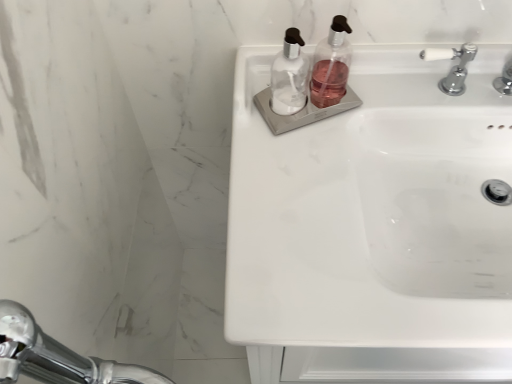
Question: Is white glossy sink at upper right at the right side of transparent plastic soap dispenser at center, the second soap dispenser positioned from the right?

Choices:
 (A) yes
 (B) no

Answer: (A)

Question: From a real-world perspective, does white glossy sink at upper right sit lower than transparent plastic soap dispenser at center, the second soap dispenser positioned from the right?

Choices:
 (A) no
 (B) yes

Answer: (B)

Question: From the image's perspective, is white glossy sink at upper right beneath transparent plastic soap dispenser at center, which is the 1th soap dispenser from left to right?

Choices:
 (A) no
 (B) yes

Answer: (B)

Question: Can you confirm if white glossy sink at upper right is taller than transparent plastic soap dispenser at center, which is the 1th soap dispenser from left to right?

Choices:
 (A) yes
 (B) no

Answer: (A)

Question: Is white glossy sink at upper right positioned with its back to transparent plastic soap dispenser at center, which is the 1th soap dispenser from left to right?

Choices:
 (A) yes
 (B) no

Answer: (B)

Question: Is transparent plastic soap dispenser at center, the second soap dispenser positioned from the right, inside white glossy sink at upper right?

Choices:
 (A) no
 (B) yes

Answer: (A)

Question: Considering the relative sizes of white ceramic tap at upper right and white glossy sink at upper right in the image provided, is white ceramic tap at upper right wider than white glossy sink at upper right?

Choices:
 (A) no
 (B) yes

Answer: (A)

Question: Does white ceramic tap at upper right lie in front of white glossy sink at upper right?

Choices:
 (A) yes
 (B) no

Answer: (B)

Question: From a real-world perspective, is white ceramic tap at upper right under white glossy sink at upper right?

Choices:
 (A) yes
 (B) no

Answer: (B)

Question: Could you tell me if white ceramic tap at upper right is turned towards white glossy sink at upper right?

Choices:
 (A) yes
 (B) no

Answer: (B)

Question: Is white glossy sink at upper right surrounded by white ceramic tap at upper right?

Choices:
 (A) yes
 (B) no

Answer: (B)

Question: Can we say white ceramic tap at upper right lies outside white glossy sink at upper right?

Choices:
 (A) yes
 (B) no

Answer: (B)

Question: From a real-world perspective, is white ceramic tap at upper right positioned under transparent plastic soap dispenser at center, the second soap dispenser positioned from the right, based on gravity?

Choices:
 (A) no
 (B) yes

Answer: (B)